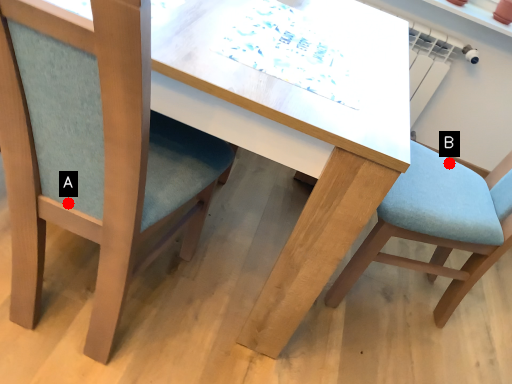
Question: Two points are circled on the image, labeled by A and B beside each circle. Which point appears closest to the camera in this image?

Choices:
 (A) A is closer
 (B) B is closer

Answer: (A)